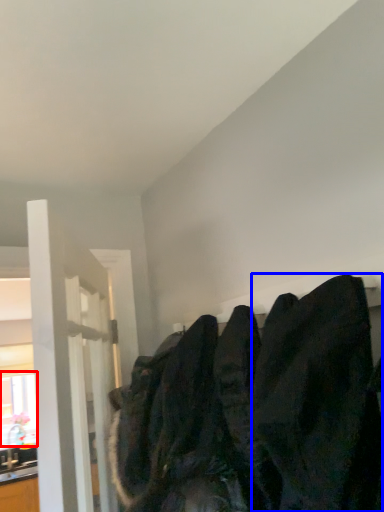
Question: Which object is further to the camera taking this photo, window (highlighted by a red box) or clothing (highlighted by a blue box)?

Choices:
 (A) window
 (B) clothing

Answer: (A)